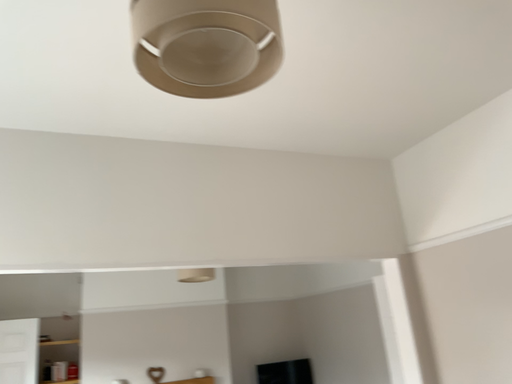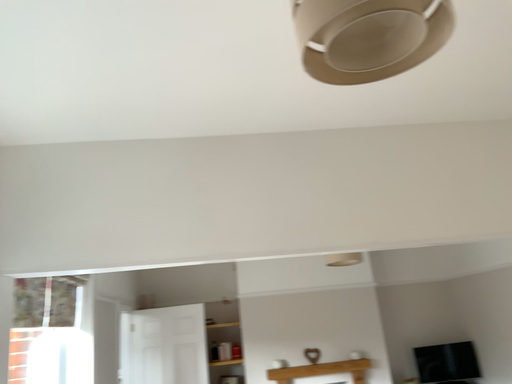
Question: Which way did the camera rotate in the video?

Choices:
 (A) rotated right
 (B) rotated left

Answer: (B)